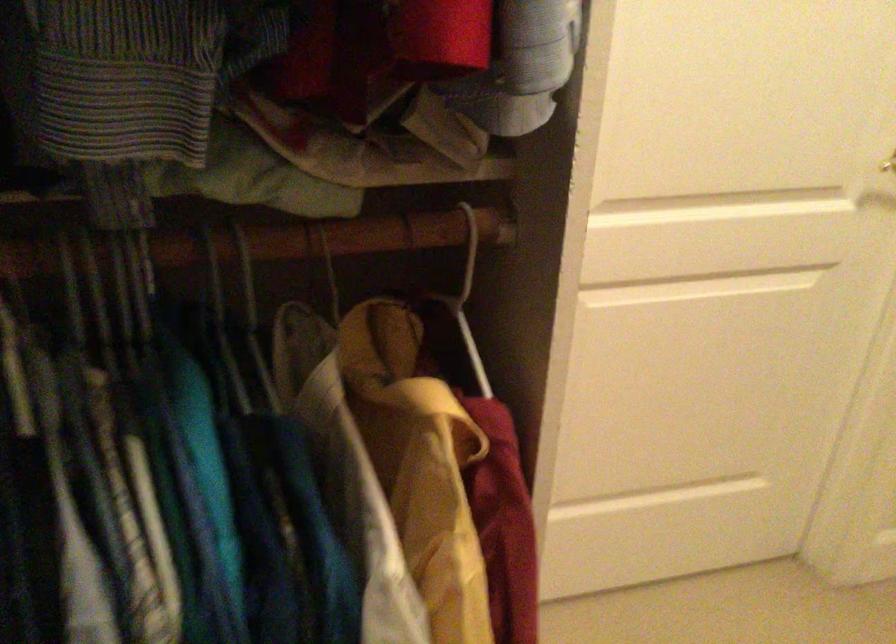
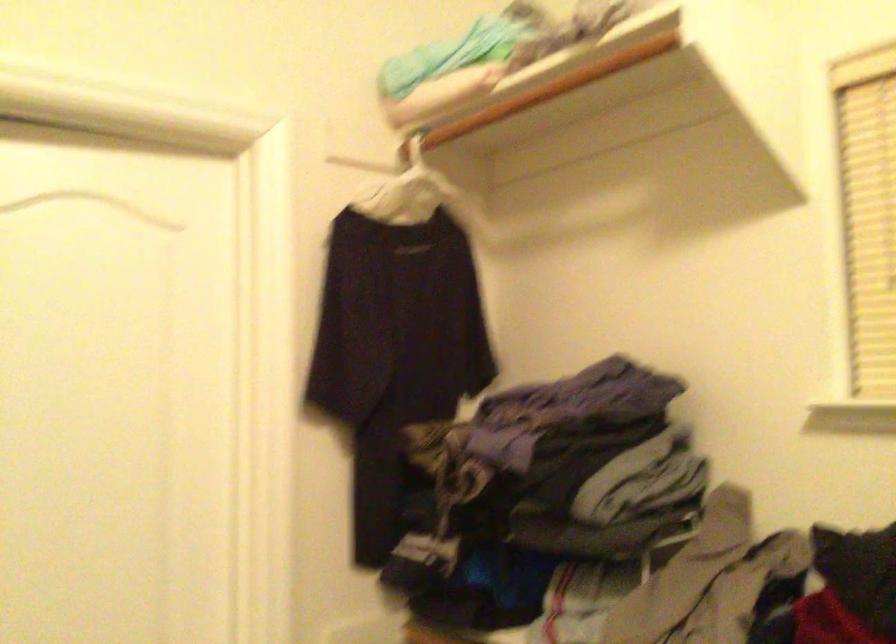
Question: The images are taken continuously from a first-person perspective. In which direction is your viewpoint rotating?

Choices:
 (A) Left
 (B) Right
 (C) Up
 (D) Down

Answer: (B)